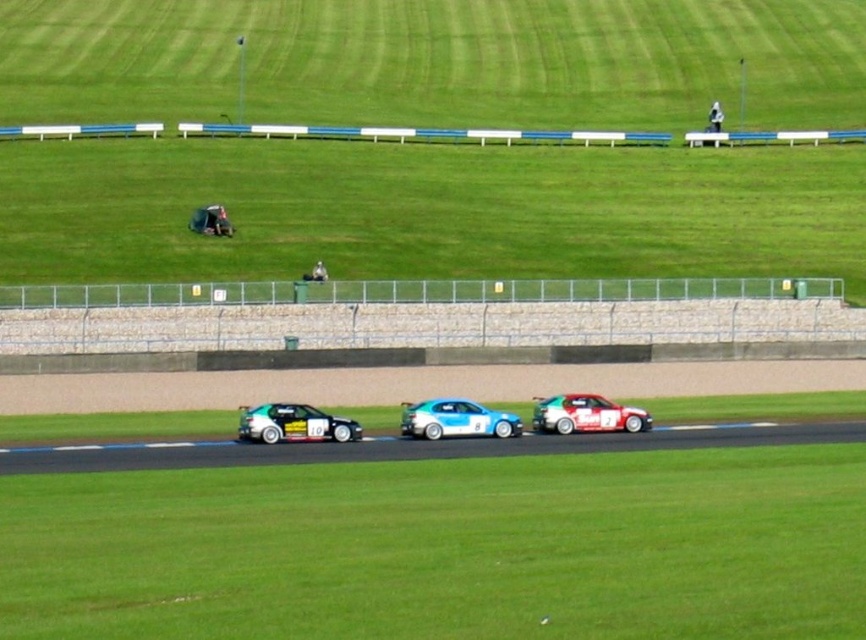
In the scene shown: Is green matte race car at center wider than shiny white sports car at center?

Indeed, green matte race car at center has a greater width compared to shiny white sports car at center.

Is point (606, 428) less distant than point (572, 397)?

No, (606, 428) is behind (572, 397).

Measure the distance between green matte race car at center and camera.

They are 51.90 meters apart.

Find the location of a particular element. This screenshot has width=866, height=640. green matte race car at center is located at coordinates (456, 419).

Based on the photo, does smooth asphalt race track at center appear on the right side of green matte race car at center?

Indeed, smooth asphalt race track at center is positioned on the right side of green matte race car at center.

Looking at this image, can you confirm if smooth asphalt race track at center is shorter than green matte race car at center?

Yes.

Is point (692, 433) more distant than point (476, 436)?

Yes, it is.

Where is `smooth asphalt race track at center`? The width and height of the screenshot is (866, 640). smooth asphalt race track at center is located at coordinates (410, 448).

Is point (41, 385) closer to camera compared to point (671, 433)?

No, (41, 385) is behind (671, 433).

This screenshot has width=866, height=640. In order to click on brown asphalt track at center in this screenshot , I will do `click(414, 385)`.

Who is more distant from viewer, (774,364) or (576,435)?

The point (774,364) is behind.

Where is `brown asphalt track at center`? This screenshot has height=640, width=866. brown asphalt track at center is located at coordinates (414, 385).